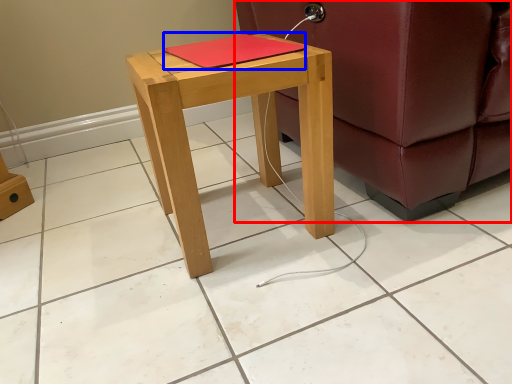
Question: Among these objects, which one is farthest to the camera, studio couch (highlighted by a red box) or notebook (highlighted by a blue box)?

Choices:
 (A) studio couch
 (B) notebook

Answer: (B)